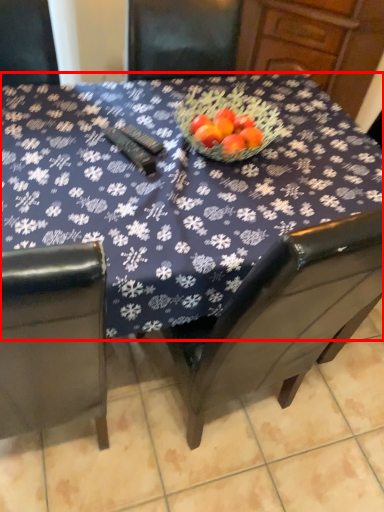
Question: Considering the relative positions of table (annotated by the red box) and tile in the image provided, where is table (annotated by the red box) located with respect to the staircase?

Choices:
 (A) left
 (B) right

Answer: (A)